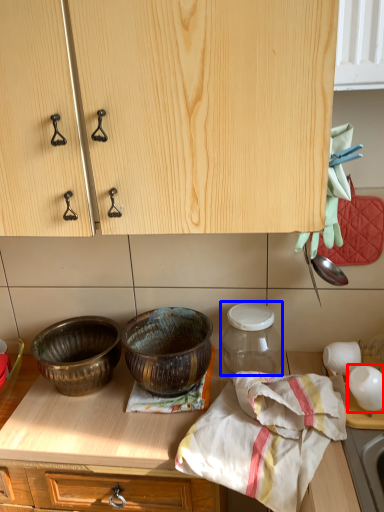
Question: Which object appears farthest to the camera in this image, tableware (highlighted by a red box) or glass jar (highlighted by a blue box)?

Choices:
 (A) tableware
 (B) glass jar

Answer: (B)